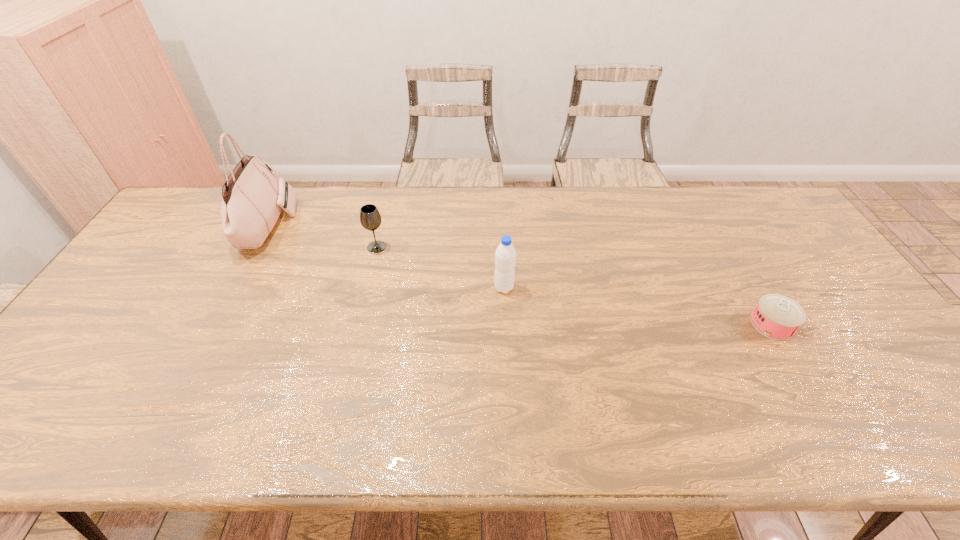
In order to click on vacant space situated 0.340m on the front of the wineglass in this screenshot , I will do coord(353,346).

The height and width of the screenshot is (540, 960). I want to click on free space located on the right of the can, so click(830, 324).

Where is `object at the far edge`? object at the far edge is located at coordinates point(252,197).

Where is `vacant area at the far edge of the desktop`? Image resolution: width=960 pixels, height=540 pixels. vacant area at the far edge of the desktop is located at coordinates (628, 215).

The height and width of the screenshot is (540, 960). I want to click on free location at the near edge of the desktop, so click(340, 448).

The image size is (960, 540). What are the coordinates of `free space at the left edge of the desktop` in the screenshot? It's located at (139, 266).

The image size is (960, 540). Find the location of `vacant space at the right edge of the desktop`. vacant space at the right edge of the desktop is located at coordinates (771, 243).

You are a GUI agent. You are given a task and a screenshot of the screen. Output one action in this format:
    pyautogui.click(x=<x>, y=<y>)
    Task: Click on the vacant area that lies between the leftmost object and the third shortest object
    Image resolution: width=960 pixels, height=540 pixels.
    Given the screenshot: What is the action you would take?
    click(386, 256)

Where is `empty space between the third object from left to right and the second object from left to right`? The height and width of the screenshot is (540, 960). empty space between the third object from left to right and the second object from left to right is located at coordinates (441, 267).

This screenshot has height=540, width=960. Find the location of `free space that is in between the can and the second object from left to right`. free space that is in between the can and the second object from left to right is located at coordinates (574, 286).